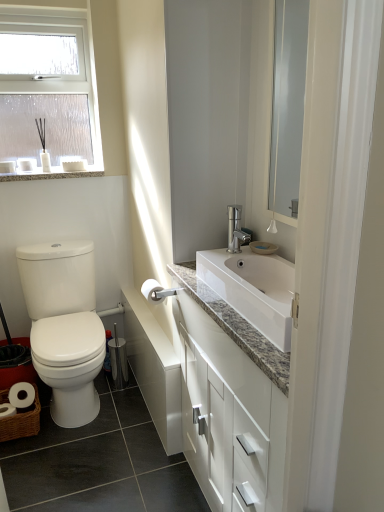
In order to face white glossy cabinet at center, should I rotate leftwards or rightwards?

Turn right approximately 9.248 degrees to face it.

Image resolution: width=384 pixels, height=512 pixels. Describe the element at coordinates (230, 401) in the screenshot. I see `white glossy cabinet at center` at that location.

The width and height of the screenshot is (384, 512). I want to click on granite countertop at upper left, so click(50, 174).

Image resolution: width=384 pixels, height=512 pixels. Describe the element at coordinates (47, 92) in the screenshot. I see `frosted glass window at upper left` at that location.

Find the location of a particular element. white glossy cabinet at center is located at coordinates click(x=230, y=401).

Between granite countertop at upper left and frosted glass window at upper left, which one is positioned behind?

granite countertop at upper left is more distant.

Can you tell me how much granite countertop at upper left and frosted glass window at upper left differ in facing direction?

There is a 0.116-degree angle between the facing directions of granite countertop at upper left and frosted glass window at upper left.

In terms of width, does granite countertop at upper left look wider or thinner when compared to frosted glass window at upper left?

In the image, granite countertop at upper left appears to be wider than frosted glass window at upper left.

From the image's perspective, is granite countertop at upper left on top of frosted glass window at upper left?

No.

Is frosted glass window at upper left facing away from granite countertop at upper left?

No, frosted glass window at upper left's orientation is not away from granite countertop at upper left.

Based on their sizes in the image, would you say frosted glass window at upper left is bigger or smaller than granite countertop at upper left?

frosted glass window at upper left is bigger than granite countertop at upper left.

From the image's perspective, which one is positioned lower, frosted glass window at upper left or granite countertop at upper left?

granite countertop at upper left appears lower in the image.

From a real-world perspective, which is physically below, white glossy toilet at left or white glossy cabinet at center?

From a 3D spatial view, white glossy toilet at left is below.

Is white glossy toilet at left beside white glossy cabinet at center?

No.

Where is `bathroom cabinet that appears above the white glossy toilet at left (from a real-world perspective)`? The width and height of the screenshot is (384, 512). bathroom cabinet that appears above the white glossy toilet at left (from a real-world perspective) is located at coordinates (230, 401).

Does granite countertop at upper left have a greater width compared to white glossy cabinet at center?

In fact, granite countertop at upper left might be narrower than white glossy cabinet at center.

Is granite countertop at upper left in front of or behind white glossy cabinet at center in the image?

granite countertop at upper left is positioned farther from the viewer than white glossy cabinet at center.

Which is less distant, (x=98, y=175) or (x=237, y=471)?

Point (x=98, y=175) is positioned farther from the camera compared to point (x=237, y=471).

Could you tell me if granite countertop at upper left is turned towards white glossy cabinet at center?

No, granite countertop at upper left is not turned towards white glossy cabinet at center.

From the image's perspective, is white glossy toilet at left on top of frosted glass window at upper left?

Actually, white glossy toilet at left appears below frosted glass window at upper left in the image.

Is white glossy toilet at left thinner than frosted glass window at upper left?

No, white glossy toilet at left is not thinner than frosted glass window at upper left.

From a real-world perspective, relative to frosted glass window at upper left, is white glossy toilet at left vertically above or below?

From a real-world perspective, white glossy toilet at left is physically below frosted glass window at upper left.

Does point (195, 444) appear closer or farther from the camera than point (52, 173)?

Point (195, 444) is positioned closer to the camera compared to point (52, 173).

How far apart are white glossy cabinet at center and granite countertop at upper left?

white glossy cabinet at center is 1.40 meters away from granite countertop at upper left.

Is white glossy cabinet at center to the left of granite countertop at upper left from the viewer's perspective?

No, white glossy cabinet at center is not to the left of granite countertop at upper left.

Which point is more forward, (251, 458) or (94, 155)?

The point (251, 458) is closer.

Is white glossy cabinet at center oriented away from frosted glass window at upper left?

white glossy cabinet at center does not have its back to frosted glass window at upper left.

Is white glossy cabinet at center not inside frosted glass window at upper left?

Yes, white glossy cabinet at center is located beyond the bounds of frosted glass window at upper left.

Is white glossy cabinet at center closer to the viewer compared to frosted glass window at upper left?

Yes.

Identify the location of window in front of the granite countertop at upper left. tap(47, 92).

This screenshot has width=384, height=512. In order to click on window located above the granite countertop at upper left (from a real-world perspective) in this screenshot , I will do `click(47, 92)`.

Looking at the image, which one is located closer to white glossy cabinet at center, frosted glass window at upper left or granite countertop at upper left?

frosted glass window at upper left lies closer to white glossy cabinet at center than the other object.

Based on their spatial positions, is white glossy cabinet at center or white glossy toilet at left further from granite countertop at upper left?

white glossy cabinet at center is positioned further to the anchor granite countertop at upper left.

Which object lies nearer to the anchor point white glossy cabinet at center, white glossy toilet at left or frosted glass window at upper left?

Among the two, white glossy toilet at left is located nearer to white glossy cabinet at center.

Based on their spatial positions, is white glossy cabinet at center or white glossy toilet at left further from frosted glass window at upper left?

Based on the image, white glossy cabinet at center appears to be further to frosted glass window at upper left.

Which object lies further to the anchor point frosted glass window at upper left, white glossy toilet at left or white glossy cabinet at center?

Among the two, white glossy cabinet at center is located further to frosted glass window at upper left.

Based on their spatial positions, is white glossy toilet at left or granite countertop at upper left closer to frosted glass window at upper left?

Among the two, granite countertop at upper left is located nearer to frosted glass window at upper left.

Considering their positions, is granite countertop at upper left positioned further to frosted glass window at upper left than white glossy cabinet at center?

white glossy cabinet at center is positioned further to the anchor frosted glass window at upper left.

From the image, which object appears to be farther from frosted glass window at upper left, white glossy cabinet at center or granite countertop at upper left?

Among the two, white glossy cabinet at center is located further to frosted glass window at upper left.

The width and height of the screenshot is (384, 512). I want to click on toilet located between white glossy cabinet at center and granite countertop at upper left in the depth direction, so click(x=64, y=326).

I want to click on window sill between frosted glass window at upper left and white glossy cabinet at center in the vertical direction, so click(50, 174).

Locate an element on the screen. window sill that lies between frosted glass window at upper left and white glossy toilet at left from top to bottom is located at coordinates (50, 174).

In order to click on toilet between frosted glass window at upper left and white glossy cabinet at center in the vertical direction in this screenshot , I will do `click(64, 326)`.